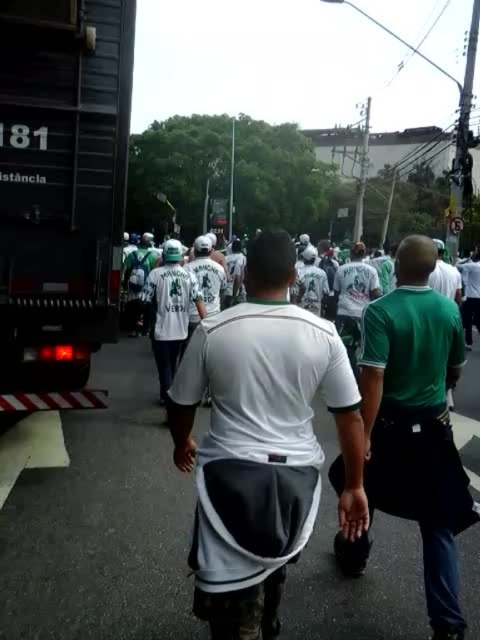
You are standing in the street and see two points marked in the image. The first point is at coordinate point(11, 109) and the second is at point(225, 436). Which point is closer to you?

Point(11, 109) is closer to you because it is further to the viewer than point(225, 436).

You are standing in the street and see the dark gray metal truck at left. Where would you look to find it?

The dark gray metal truck at left is located at the 2D coordinates point (61, 179).

You are a photographer standing behind the group of people in the image. You want to take a photo of both the white matte shirt at center and the green matte shirt at center without any overlap between them. Given that your camera has a maximum focus range of 40 centimeters, can you capture both shirts clearly in the same frame?

The distance between the white matte shirt at center and green matte shirt at center is 45.80 centimeters, which exceeds the camera maximum focus range of 40 centimeters. Therefore, you cannot capture both shirts clearly in the same frame.